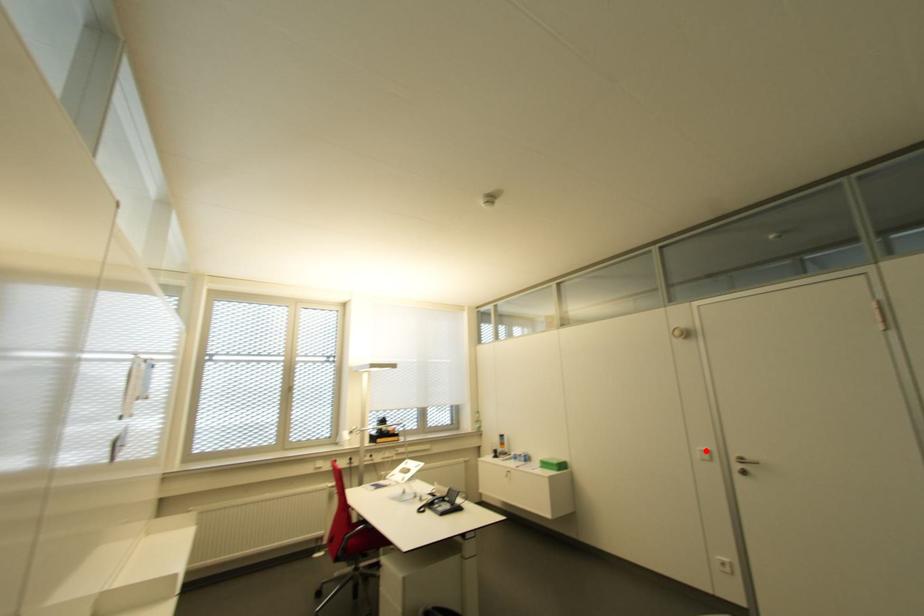
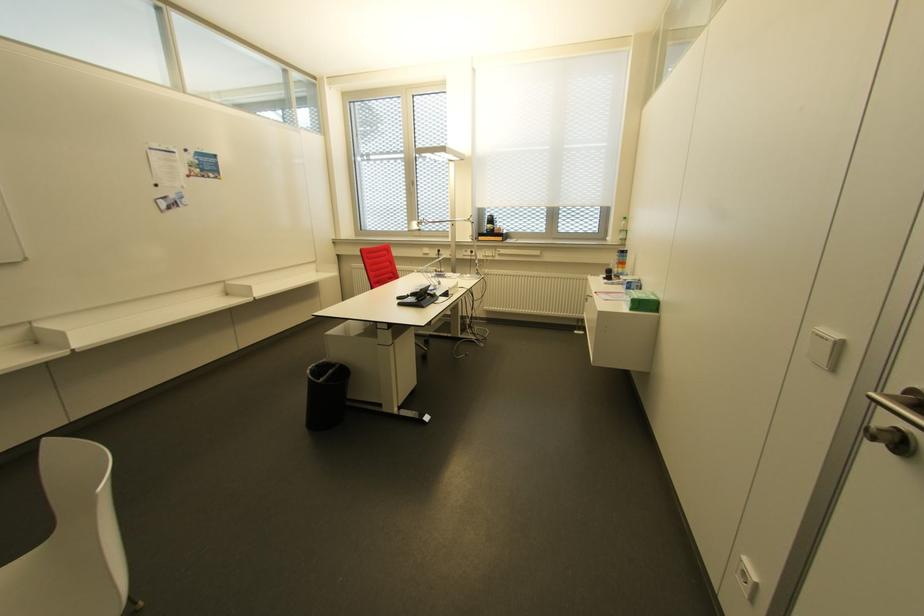
Find the pixel in the second image that matches the highlighted location in the first image.

(833, 334)